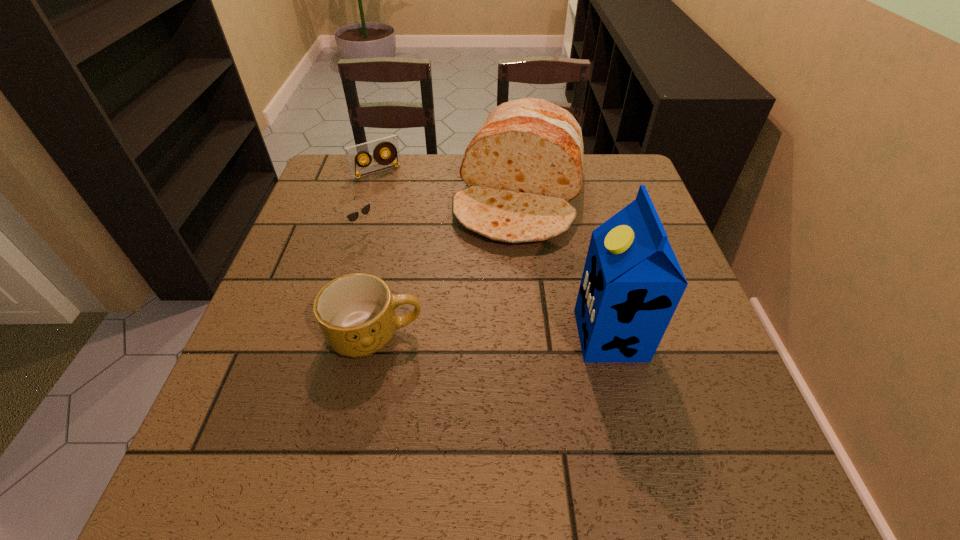
Locate an element on the screen. mug at the left edge is located at coordinates (356, 312).

Where is `videotape that is at the left edge`? videotape that is at the left edge is located at coordinates (354, 154).

What are the coordinates of `sunglasses that is positioned at the left edge` in the screenshot? It's located at (353, 216).

Where is `carton located in the right edge section of the desktop`? carton located in the right edge section of the desktop is located at coordinates (632, 283).

Find the location of a particular element. Image resolution: width=960 pixels, height=540 pixels. bread that is at the right edge is located at coordinates (525, 163).

This screenshot has width=960, height=540. Identify the location of object that is at the far left corner. (354, 154).

Find the location of a particular element. object present at the far right corner is located at coordinates (525, 163).

Identify the location of vacant space at the far edge. This screenshot has width=960, height=540. (446, 201).

In the image, there is a desktop. Identify the location of vacant space at the near edge. (626, 390).

At what (x,y) coordinates should I click in order to perform the action: click on vacant region at the left edge. Please return your answer as a coordinate pair (x, y). Image resolution: width=960 pixels, height=540 pixels. Looking at the image, I should click on (293, 267).